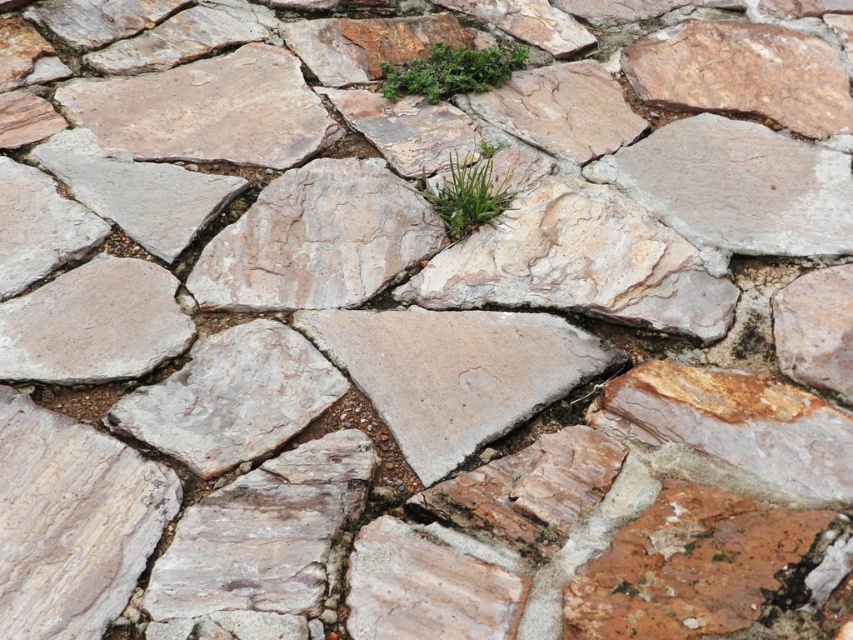
Question: Does green leafy plant at upper center have a larger size compared to green leafy grass at center?

Choices:
 (A) yes
 (B) no

Answer: (A)

Question: Which object appears farthest from the camera in this image?

Choices:
 (A) green leafy plant at upper center
 (B) green leafy grass at center

Answer: (A)

Question: Which point is farther to the camera?

Choices:
 (A) green leafy plant at upper center
 (B) green leafy grass at center

Answer: (A)

Question: Is green leafy plant at upper center wider than green leafy grass at center?

Choices:
 (A) no
 (B) yes

Answer: (B)

Question: Is green leafy plant at upper center smaller than green leafy grass at center?

Choices:
 (A) yes
 (B) no

Answer: (B)